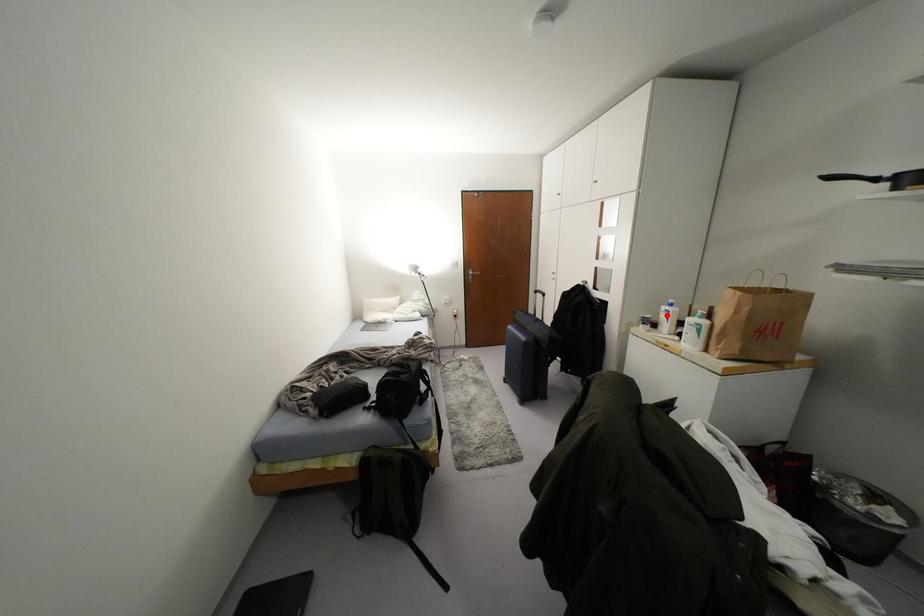
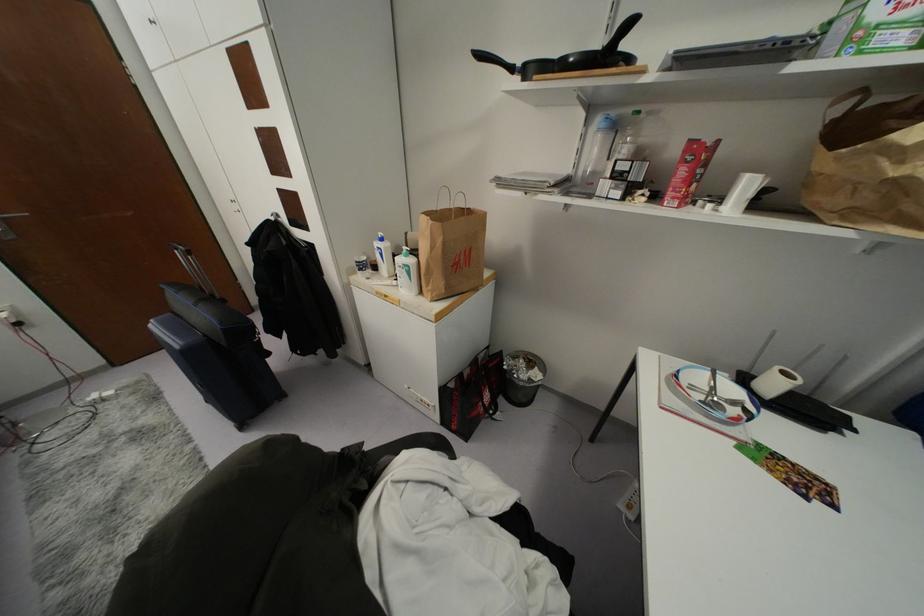
Locate, in the second image, the point that corresponds to the highlighted location in the first image.

(381, 254)